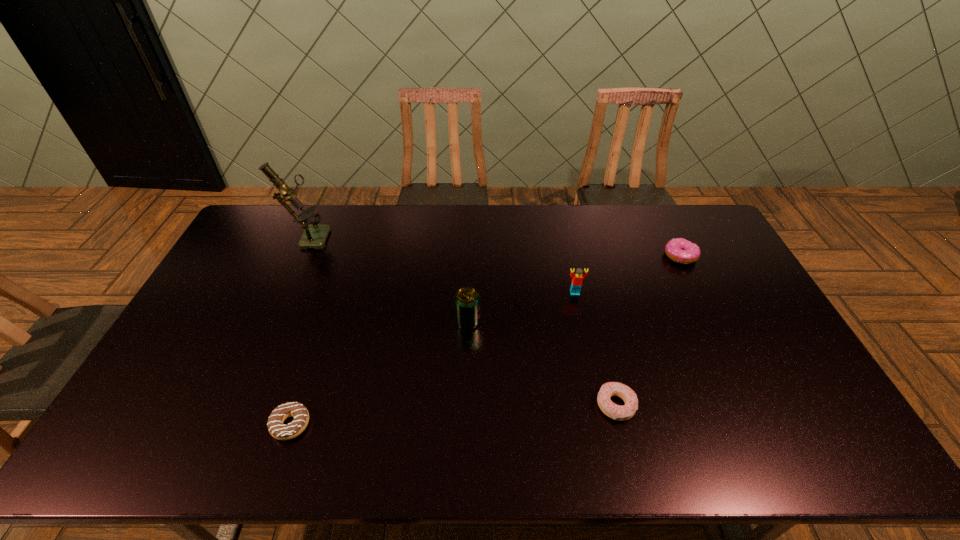
You are a GUI agent. You are given a task and a screenshot of the screen. Output one action in this format:
    pyautogui.click(x=<x>, y=<y>)
    Task: Click on the free space that satisfies the following two spatial constraints: 1. at the eyepiece of the microscope; 2. on the right side of the leftmost doughnut
    Image resolution: width=960 pixels, height=540 pixels.
    Given the screenshot: What is the action you would take?
    pyautogui.click(x=223, y=424)

Where is `free space that satisfies the following two spatial constraints: 1. on the back side of the third nearest object; 2. at the eyepiece of the leftmost object`? Image resolution: width=960 pixels, height=540 pixels. free space that satisfies the following two spatial constraints: 1. on the back side of the third nearest object; 2. at the eyepiece of the leftmost object is located at coordinates (469, 236).

Identify the location of vacant area that satisfies the following two spatial constraints: 1. at the eyepiece of the microscope; 2. on the back side of the fourth object from right to left. This screenshot has width=960, height=540. (270, 321).

At what (x,y) coordinates should I click in order to perform the action: click on vacant space that satisfies the following two spatial constraints: 1. at the eyepiece of the leftmost object; 2. on the right side of the third object from left to right. Please return your answer as a coordinate pair (x, y). The width and height of the screenshot is (960, 540). Looking at the image, I should click on pos(270,321).

Find the location of a particular element. This screenshot has width=960, height=540. free point that satisfies the following two spatial constraints: 1. at the eyepiece of the leftmost object; 2. on the back side of the farthest doughnut is located at coordinates (299, 256).

The width and height of the screenshot is (960, 540). I want to click on vacant space that satisfies the following two spatial constraints: 1. on the back side of the fifth object from right to left; 2. on the left side of the rightmost doughnut, so click(x=347, y=256).